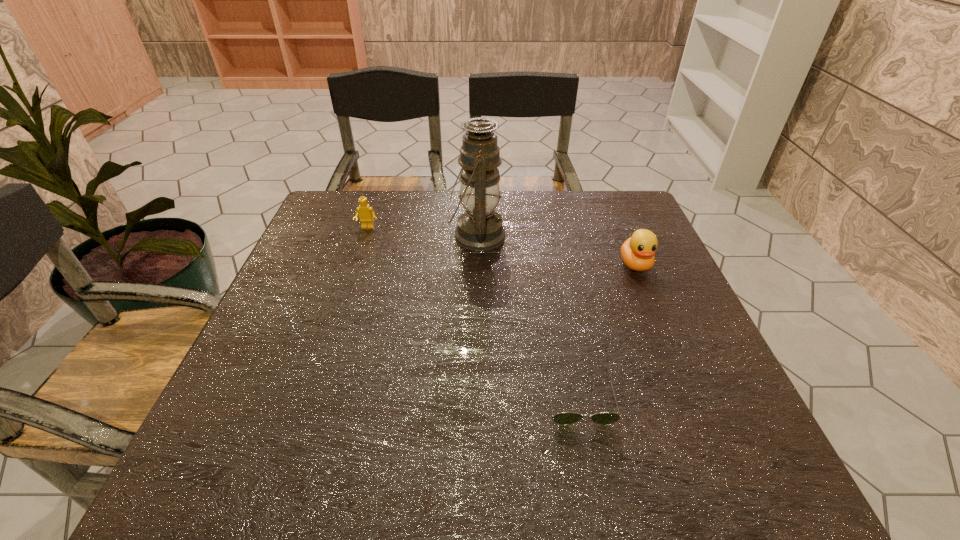
You are a GUI agent. You are given a task and a screenshot of the screen. Output one action in this format:
    pyautogui.click(x=<x>, y=<y>)
    Task: Click on the oil lamp at the far edge
    
    Given the screenshot: What is the action you would take?
    pyautogui.click(x=480, y=228)

The height and width of the screenshot is (540, 960). Find the location of `Lego located in the far edge section of the desktop`. Lego located in the far edge section of the desktop is located at coordinates (366, 213).

Locate an element on the screen. This screenshot has height=540, width=960. object present at the left edge is located at coordinates (366, 213).

Locate an element on the screen. object that is at the right edge is located at coordinates (637, 252).

At what (x,y) coordinates should I click in order to perform the action: click on object that is at the far left corner. Please return your answer as a coordinate pair (x, y). Looking at the image, I should click on (366, 213).

The width and height of the screenshot is (960, 540). What are the coordinates of `vacant space at the far edge of the desktop` in the screenshot? It's located at (379, 218).

Locate an element on the screen. The height and width of the screenshot is (540, 960). vacant area at the near edge of the desktop is located at coordinates (372, 447).

Locate an element on the screen. Image resolution: width=960 pixels, height=540 pixels. free region at the left edge is located at coordinates (x=315, y=290).

You are a GUI agent. You are given a task and a screenshot of the screen. Output one action in this format:
    pyautogui.click(x=<x>, y=<y>)
    Task: Click on the blank space at the right edge of the desktop
    
    Given the screenshot: What is the action you would take?
    pyautogui.click(x=651, y=355)

Where is `blank area at the near left corner`? This screenshot has height=540, width=960. blank area at the near left corner is located at coordinates (247, 478).